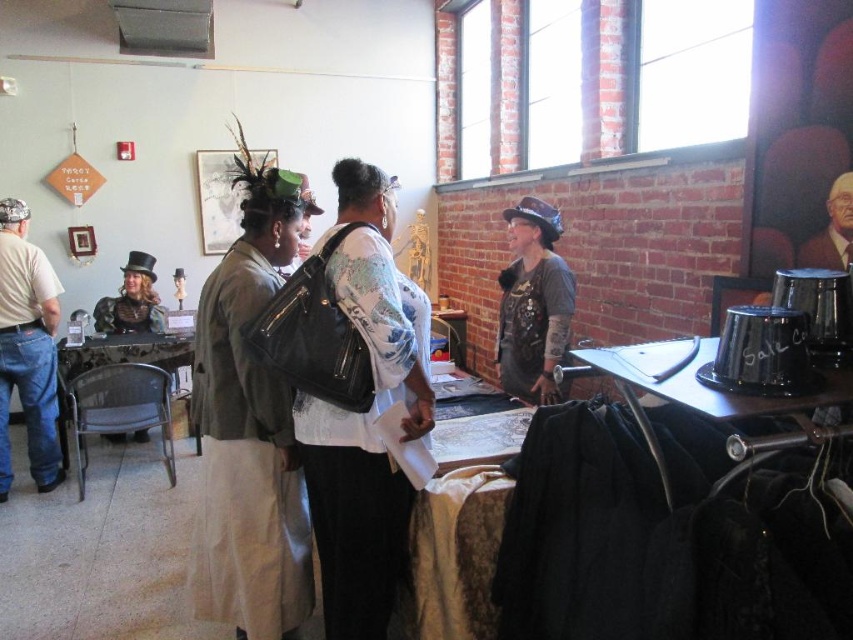
Question: Can you confirm if matte black backpack at center is bigger than steampunk-style hat at center?

Choices:
 (A) yes
 (B) no

Answer: (A)

Question: Does denim jeans at left have a larger size compared to smooth black hat at upper right?

Choices:
 (A) yes
 (B) no

Answer: (A)

Question: Which object appears farthest from the camera in this image?

Choices:
 (A) metallic silver table at center
 (B) smooth black hat at upper right

Answer: (A)

Question: Where is metallic silver table at center located in relation to steampunk-style hat at center in the image?

Choices:
 (A) left
 (B) right

Answer: (A)

Question: Which of these objects is positioned closest to the matte black purse at center?

Choices:
 (A) denim jeans at left
 (B) smooth black hat at upper right

Answer: (B)

Question: Which object is farther from the camera taking this photo?

Choices:
 (A) matte black backpack at center
 (B) smooth black hat at upper right

Answer: (B)